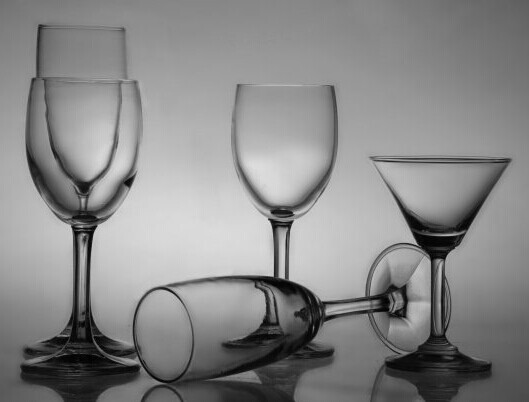
Image resolution: width=529 pixels, height=402 pixels. Find the location of `upright glass`. upright glass is located at coordinates (464, 179), (289, 147), (43, 161), (87, 47).